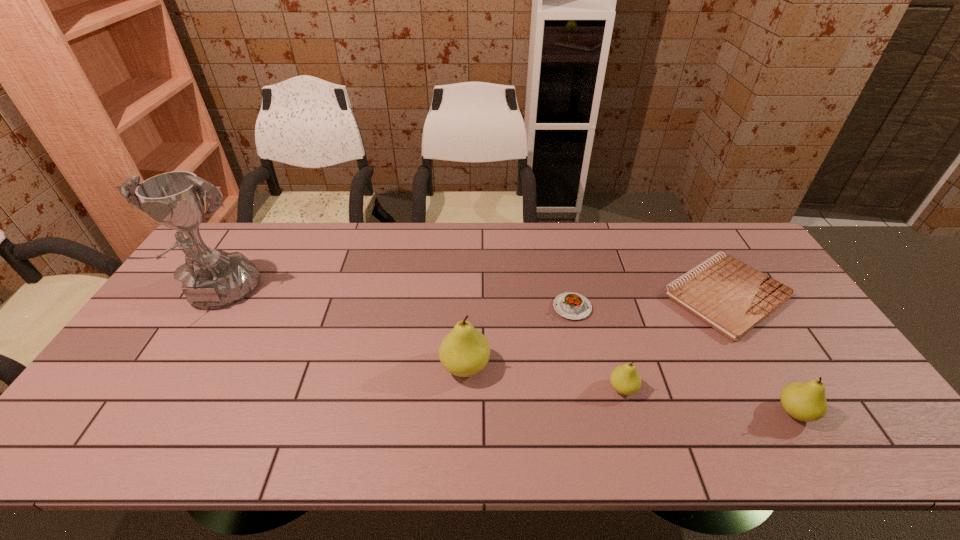
What are the coordinates of `vacant space that satisfies the following two spatial constraints: 1. on the front side of the second tallest object; 2. on the left side of the fourth shortest object` in the screenshot? It's located at (464, 412).

The width and height of the screenshot is (960, 540). I want to click on vacant position in the image that satisfies the following two spatial constraints: 1. on the front side of the second tallest pear; 2. on the left side of the second pear from right to left, so click(x=629, y=412).

This screenshot has width=960, height=540. Find the location of `free location that satisfies the following two spatial constraints: 1. on the side with emblem of the tallest object; 2. on the left side of the second pear from right to left`. free location that satisfies the following two spatial constraints: 1. on the side with emblem of the tallest object; 2. on the left side of the second pear from right to left is located at coordinates (159, 388).

I want to click on vacant area that satisfies the following two spatial constraints: 1. on the side with emblem of the tallest pear; 2. on the left side of the award, so click(x=173, y=367).